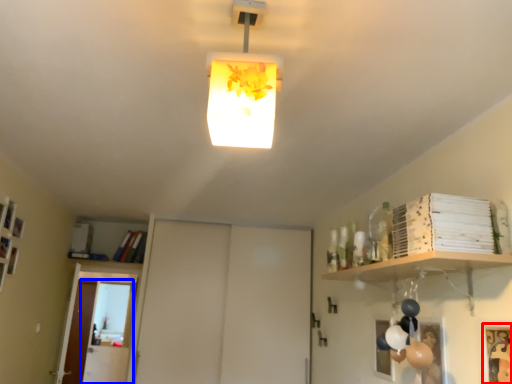
Question: Which object appears farthest to the camera in this image, picture frame (highlighted by a red box) or glass door (highlighted by a blue box)?

Choices:
 (A) picture frame
 (B) glass door

Answer: (B)